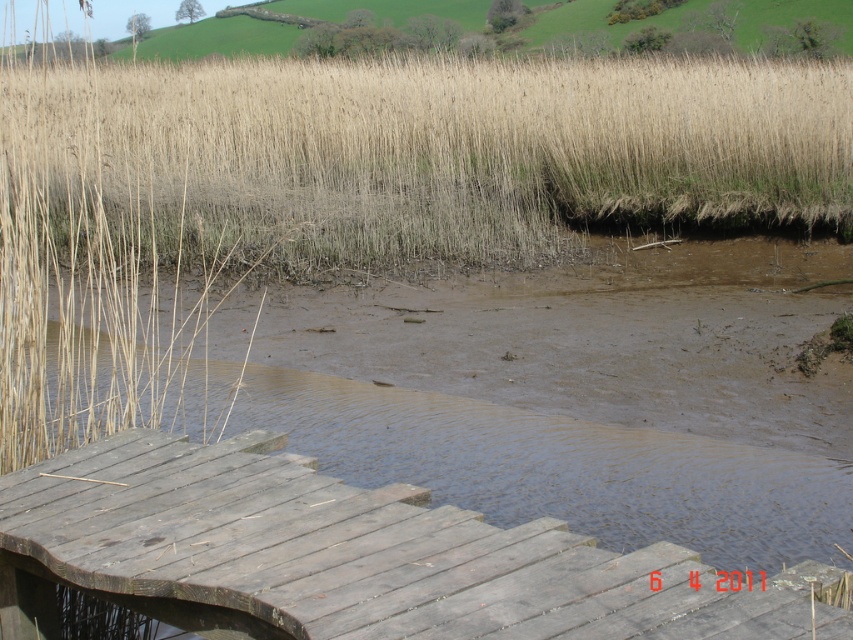
Question: Does dry grass at upper center appear over wooden dock at lower left?

Choices:
 (A) yes
 (B) no

Answer: (A)

Question: Can you confirm if dry grass at upper center is wider than wooden dock at lower left?

Choices:
 (A) no
 (B) yes

Answer: (B)

Question: Which object appears farthest from the camera in this image?

Choices:
 (A) wooden dock at lower left
 (B) dry grass at upper center

Answer: (B)

Question: In this image, where is dry grass at upper center located relative to wooden dock at lower left?

Choices:
 (A) below
 (B) above

Answer: (B)